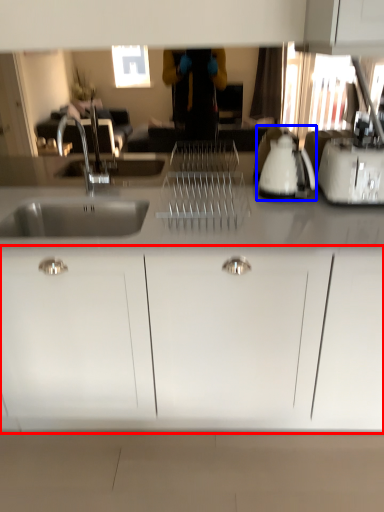
Question: Which of the following is the closest to the observer, cabinetry (highlighted by a red box) or appliance (highlighted by a blue box)?

Choices:
 (A) cabinetry
 (B) appliance

Answer: (A)